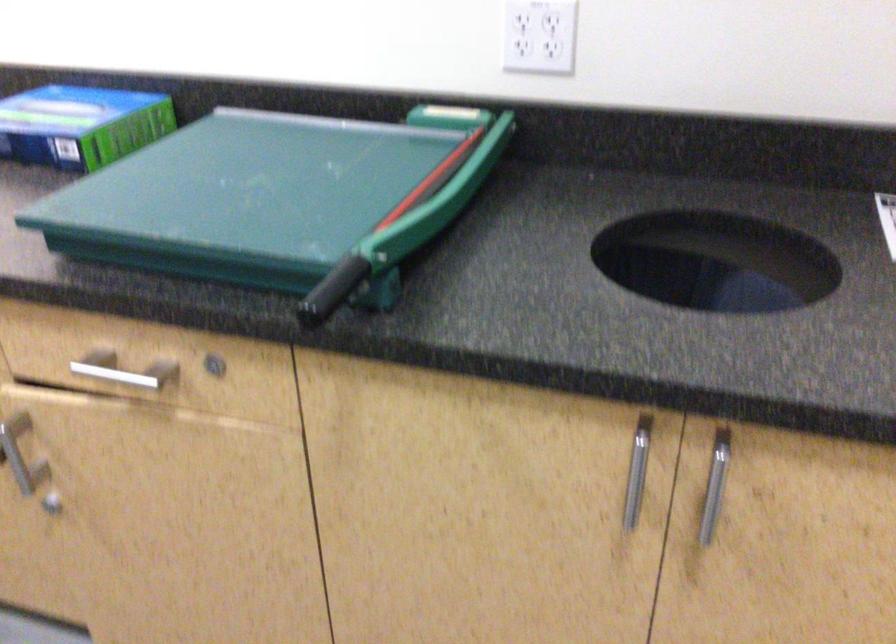
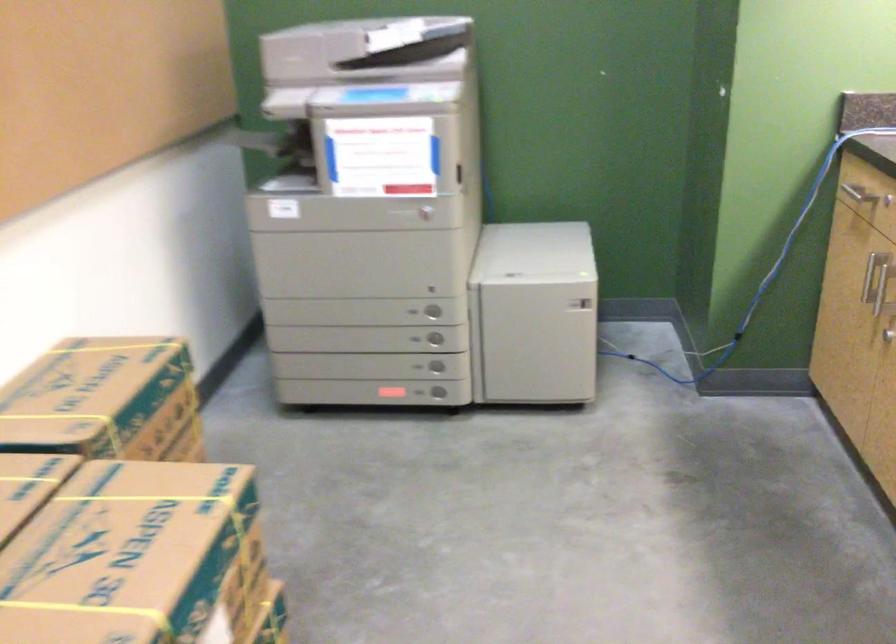
Question: The images are taken continuously from a first-person perspective. In which direction is your viewpoint rotating?

Choices:
 (A) Left
 (B) Right
 (C) Up
 (D) Down

Answer: (A)